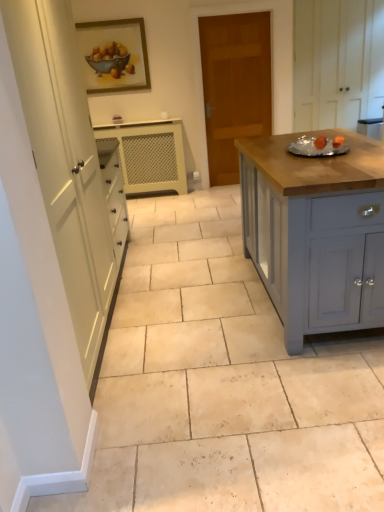
Where is `vacant space to the left of matte gray cabinet at right, which is the first cabinetry in bottom-to-top order`? This screenshot has height=512, width=384. vacant space to the left of matte gray cabinet at right, which is the first cabinetry in bottom-to-top order is located at coordinates (191, 305).